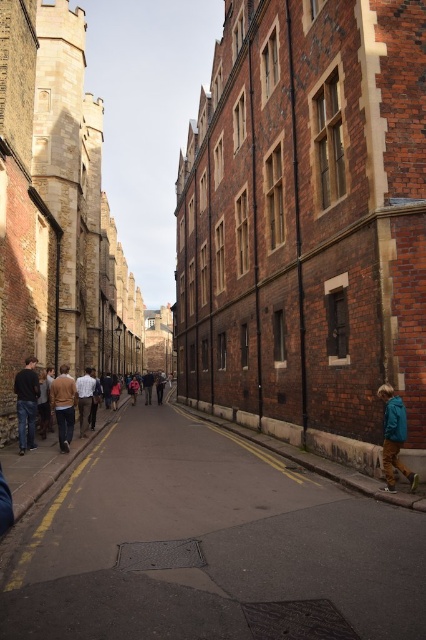
Question: Does smooth asphalt road at center have a larger size compared to brown sweater at left?

Choices:
 (A) no
 (B) yes

Answer: (B)

Question: Does dark blue jeans at left have a smaller size compared to brown sweater at left?

Choices:
 (A) no
 (B) yes

Answer: (B)

Question: Does light brown leather jacket at center appear on the right side of teal fabric jacket at lower right?

Choices:
 (A) yes
 (B) no

Answer: (B)

Question: Which object appears farthest from the camera in this image?

Choices:
 (A) teal fabric jacket at lower right
 (B) smooth asphalt road at center

Answer: (A)

Question: Which point is closer to the camera?

Choices:
 (A) brown sweater at left
 (B) smooth asphalt road at center
 (C) light brown leather jacket at center
 (D) dark blue jeans at left

Answer: (B)

Question: Among these objects, which one is nearest to the camera?

Choices:
 (A) brown sweater at left
 (B) dark blue jeans at left
 (C) light brown leather jacket at center
 (D) smooth asphalt road at center

Answer: (D)